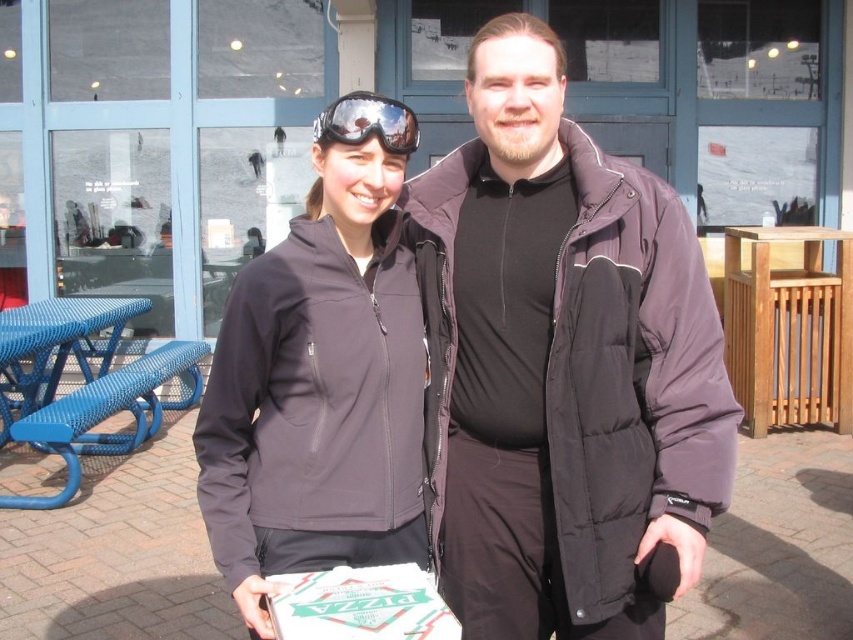
You are standing in front of the building and want to locate the dark gray softshell jacket at center. According to the coordinates provided, where would you look to find it?

The dark gray softshell jacket at center is located at point coordinates of (321, 376).

You are a photographer trying to capture a group photo of the purple puffy jacket at center and the reflective plastic goggles at center. If you want to ensure both subjects are fully visible in the frame, which one requires more horizontal space in the camera frame?

The purple puffy jacket at center requires more horizontal space in the camera frame because its width surpasses that of the reflective plastic goggles at center.